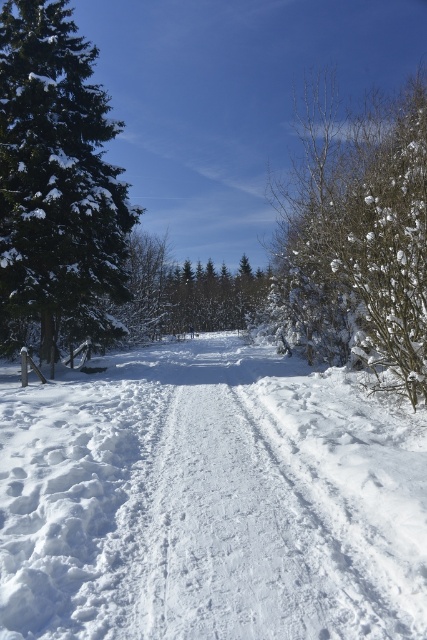
Question: Is white fluffy snow at center behind snow-covered branches at right?

Choices:
 (A) no
 (B) yes

Answer: (A)

Question: Does white fluffy snow at center have a greater width compared to snow-covered branches at right?

Choices:
 (A) no
 (B) yes

Answer: (B)

Question: Which point is farther from the camera taking this photo?

Choices:
 (A) (415, 618)
 (B) (140, 260)
 (C) (3, 339)
 (D) (415, 324)

Answer: (B)

Question: Which point is closer to the camera taking this photo?

Choices:
 (A) (351, 125)
 (B) (157, 262)
 (C) (9, 566)
 (D) (82, 74)

Answer: (C)

Question: Which object appears farthest from the camera in this image?

Choices:
 (A) white fluffy snow at center
 (B) green textured pine tree at left

Answer: (B)

Question: Considering the relative positions of green textured pine tree at left and green matte tree at center in the image provided, where is green textured pine tree at left located with respect to green matte tree at center?

Choices:
 (A) left
 (B) right

Answer: (A)